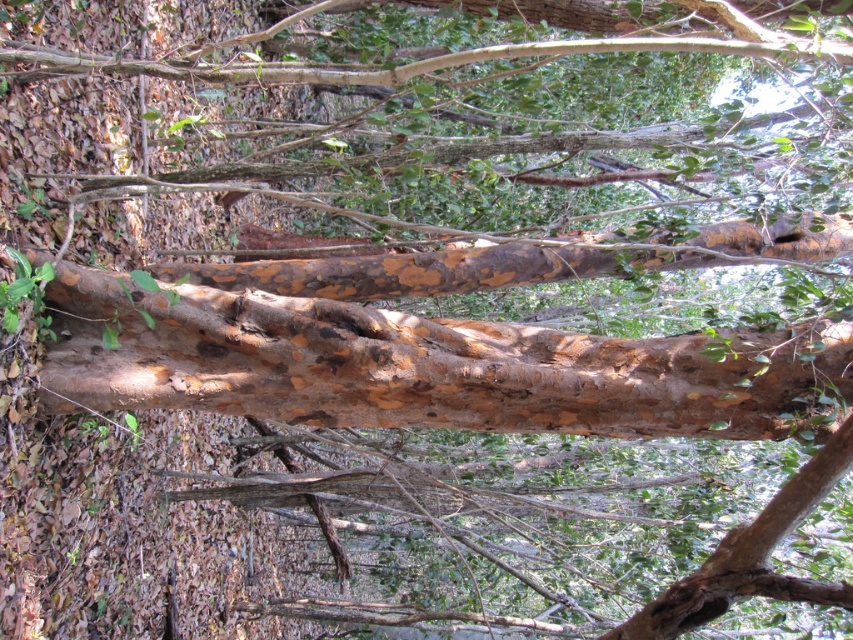
Question: Is brown textured bark at center positioned before brown/corky bark branch at upper center?

Choices:
 (A) no
 (B) yes

Answer: (A)

Question: Among these points, which one is nearest to the camera?

Choices:
 (A) (688, 364)
 (B) (755, 26)

Answer: (B)

Question: Can you confirm if brown textured bark at center is positioned above brown/corky bark branch at upper center?

Choices:
 (A) no
 (B) yes

Answer: (A)

Question: Among these points, which one is farthest from the camera?

Choices:
 (A) (843, 61)
 (B) (442, 349)

Answer: (B)

Question: Considering the relative positions of brown textured bark at center and brown/corky bark branch at upper center in the image provided, where is brown textured bark at center located with respect to brown/corky bark branch at upper center?

Choices:
 (A) right
 (B) left

Answer: (A)